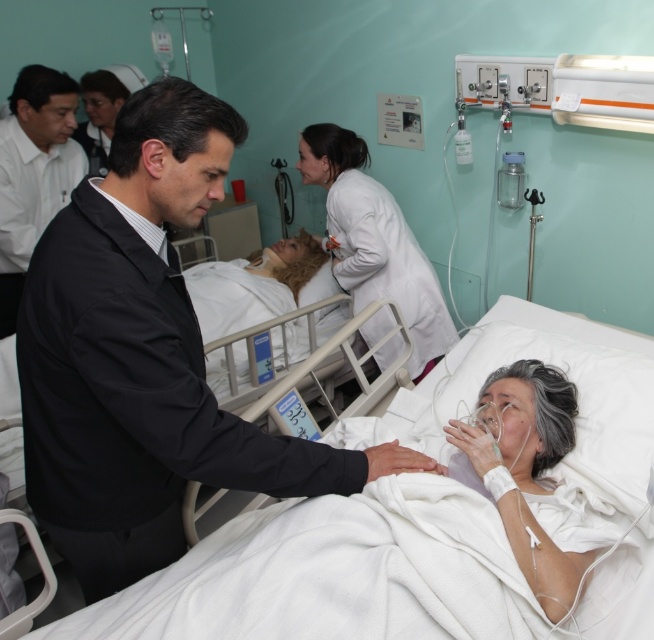
Is white fabric bed at center thinner than white matte coat at center?

No, white fabric bed at center is not thinner than white matte coat at center.

What do you see at coordinates (336, 573) in the screenshot? The height and width of the screenshot is (640, 654). I see `white fabric bed at center` at bounding box center [336, 573].

Is point (360, 604) farther from viewer compared to point (209, 387)?

No, (360, 604) is in front of (209, 387).

You are a GUI agent. You are given a task and a screenshot of the screen. Output one action in this format:
    pyautogui.click(x=<x>, y=<y>)
    Task: Click on the white fabric bed at center
    
    Given the screenshot: What is the action you would take?
    pyautogui.click(x=336, y=573)

Who is shorter, white smooth lab coat at center or smooth white pillow at center?

smooth white pillow at center

This screenshot has height=640, width=654. What are the coordinates of `white smooth lab coat at center` in the screenshot? It's located at (373, 241).

Where is `white smooth lab coat at center`? The height and width of the screenshot is (640, 654). white smooth lab coat at center is located at coordinates (373, 241).

Does white matte coat at center have a smaller size compared to white smooth shirt at upper left?

Incorrect, white matte coat at center is not smaller in size than white smooth shirt at upper left.

What do you see at coordinates (145, 358) in the screenshot?
I see `white matte coat at center` at bounding box center [145, 358].

Which is in front, point (152, 147) or point (29, 188)?

Positioned in front is point (152, 147).

The height and width of the screenshot is (640, 654). I want to click on white matte coat at center, so click(145, 358).